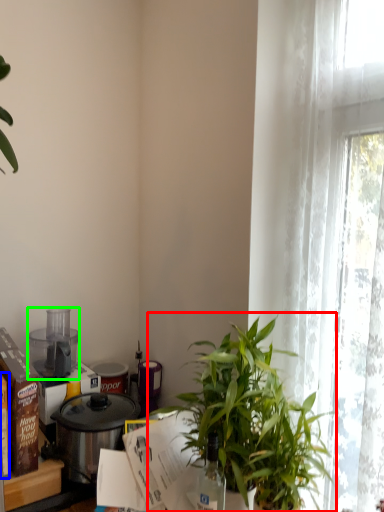
Question: Which object is the closest to the houseplant (highlighted by a red box)? Choose among these: box (highlighted by a blue box) or kitchen appliance (highlighted by a green box).

Choices:
 (A) box
 (B) kitchen appliance

Answer: (A)